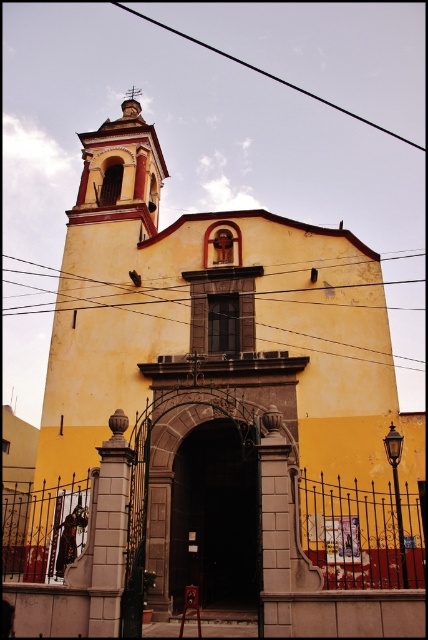
Question: Where is black wire at upper center located in relation to metallic wire at center in the image?

Choices:
 (A) below
 (B) above

Answer: (B)

Question: Is black wire at upper center closer to the viewer compared to metallic wire at center?

Choices:
 (A) no
 (B) yes

Answer: (A)

Question: Which of the following is the closest to the observer?

Choices:
 (A) (398, 280)
 (B) (398, 138)

Answer: (A)

Question: Where is black wire at upper center located in relation to metallic wire at center in the image?

Choices:
 (A) below
 (B) above

Answer: (B)